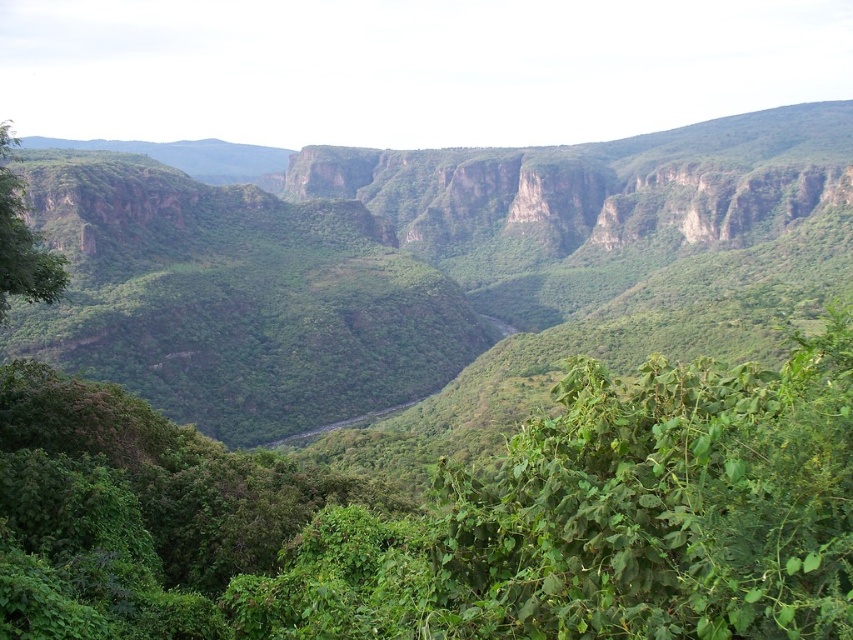
Question: Is green leafy vegetation at center to the left of green leafy tree at left from the viewer's perspective?

Choices:
 (A) yes
 (B) no

Answer: (B)

Question: Does green leafy vegetation at center have a lesser width compared to green leafy tree at left?

Choices:
 (A) yes
 (B) no

Answer: (B)

Question: Which object is farther from the camera taking this photo?

Choices:
 (A) green leafy tree at left
 (B) green leafy vegetation at center

Answer: (B)

Question: Is green leafy vegetation at center bigger than green leafy tree at left?

Choices:
 (A) yes
 (B) no

Answer: (A)

Question: Among these points, which one is nearest to the camera?

Choices:
 (A) (270, 212)
 (B) (0, 125)

Answer: (B)

Question: Among these points, which one is nearest to the camera?

Choices:
 (A) (47, 260)
 (B) (80, 257)

Answer: (A)